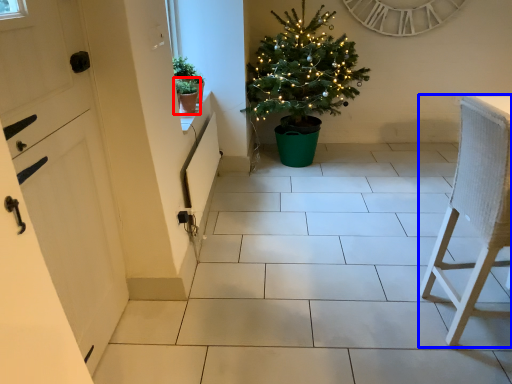
Question: Which object appears closest to the camera in this image, houseplant (highlighted by a red box) or furniture (highlighted by a blue box)?

Choices:
 (A) houseplant
 (B) furniture

Answer: (B)